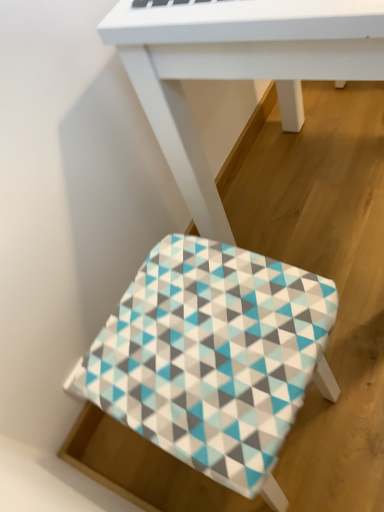
Question: Is the position of patterned fabric stool at lower center more distant than that of white matte table at center?

Choices:
 (A) yes
 (B) no

Answer: (A)

Question: Considering the relative sizes of patterned fabric stool at lower center and white matte table at center in the image provided, is patterned fabric stool at lower center shorter than white matte table at center?

Choices:
 (A) yes
 (B) no

Answer: (A)

Question: Is patterned fabric stool at lower center thinner than white matte table at center?

Choices:
 (A) yes
 (B) no

Answer: (A)

Question: Considering the relative sizes of patterned fabric stool at lower center and white matte table at center in the image provided, is patterned fabric stool at lower center taller than white matte table at center?

Choices:
 (A) no
 (B) yes

Answer: (A)

Question: Is patterned fabric stool at lower center turned away from white matte table at center?

Choices:
 (A) no
 (B) yes

Answer: (A)

Question: Considering the relative sizes of patterned fabric stool at lower center and white matte table at center in the image provided, is patterned fabric stool at lower center smaller than white matte table at center?

Choices:
 (A) yes
 (B) no

Answer: (A)

Question: Can you confirm if white matte table at center is smaller than patterned fabric stool at lower center?

Choices:
 (A) yes
 (B) no

Answer: (B)

Question: Is white matte table at center oriented away from patterned fabric stool at lower center?

Choices:
 (A) no
 (B) yes

Answer: (A)

Question: From a real-world perspective, is white matte table at center on patterned fabric stool at lower center?

Choices:
 (A) yes
 (B) no

Answer: (A)

Question: Is white matte table at center closer to the viewer compared to patterned fabric stool at lower center?

Choices:
 (A) yes
 (B) no

Answer: (A)

Question: Can you confirm if white matte table at center is taller than patterned fabric stool at lower center?

Choices:
 (A) no
 (B) yes

Answer: (B)

Question: Does white matte table at center touch patterned fabric stool at lower center?

Choices:
 (A) yes
 (B) no

Answer: (B)

Question: Does point (168, 381) appear closer or farther from the camera than point (203, 35)?

Choices:
 (A) farther
 (B) closer

Answer: (B)